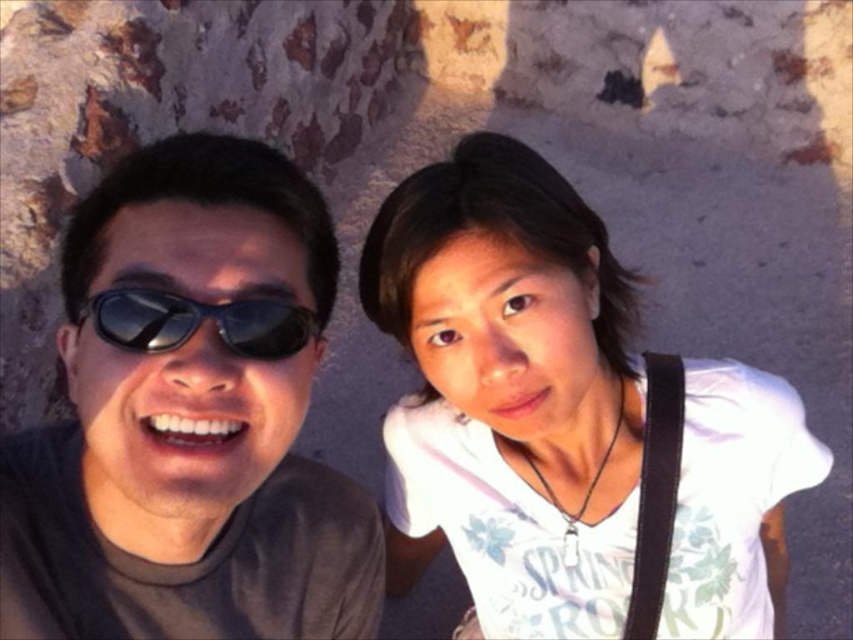
Question: Can you confirm if white matte shirt at center is positioned above black reflective sunglasses at left?

Choices:
 (A) no
 (B) yes

Answer: (A)

Question: From the image, what is the correct spatial relationship of white matte shirt at center in relation to black reflective sunglasses at left?

Choices:
 (A) right
 (B) left

Answer: (A)

Question: Which point appears closest to the camera in this image?

Choices:
 (A) (462, 252)
 (B) (103, 310)
 (C) (253, 474)

Answer: (B)

Question: Which object appears farthest from the camera in this image?

Choices:
 (A) black reflective sunglasses at left
 (B) matte black sunglasses at left
 (C) white matte shirt at center

Answer: (C)

Question: Is matte black sunglasses at left to the left of black reflective sunglasses at left from the viewer's perspective?

Choices:
 (A) no
 (B) yes

Answer: (B)

Question: Among these points, which one is farthest from the camera?

Choices:
 (A) (286, 205)
 (B) (102, 296)
 (C) (502, 400)

Answer: (C)